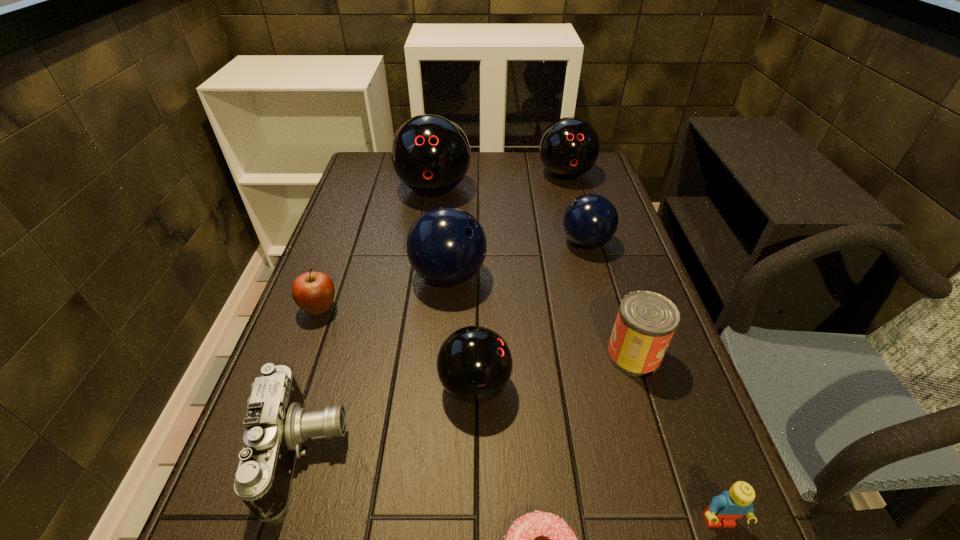
Identify the location of free space at the right edge of the desktop. This screenshot has width=960, height=540. click(x=599, y=334).

In the image, there is a desktop. Where is `vacant space at the far right corner`? vacant space at the far right corner is located at coordinates (565, 186).

I want to click on free point between the blue Lego and the camera, so click(x=512, y=487).

Where is `unoccupied position between the tallest bowling ball and the apple`? The image size is (960, 540). unoccupied position between the tallest bowling ball and the apple is located at coordinates (377, 249).

At what (x,y) coordinates should I click in order to perform the action: click on unoccupied area between the tallest bowling ball and the right blue bowling ball. Please return your answer as a coordinate pair (x, y). The image size is (960, 540). Looking at the image, I should click on click(x=510, y=216).

Where is `free space between the Lego and the nearest black bowling ball`? free space between the Lego and the nearest black bowling ball is located at coordinates (597, 453).

What are the coordinates of `free spot between the nearest bowling ball and the tallest object` in the screenshot? It's located at (454, 287).

Choose which object is the eighth nearest neighbor to the left blue bowling ball. Please provide its 2D coordinates. Your answer should be formatted as a tuple, i.e. [(x, y)], where the tuple contains the x and y coordinates of a point satisfying the conditions above.

[(539, 539)]

Where is `the second closest object to the smallest black bowling ball`? The width and height of the screenshot is (960, 540). the second closest object to the smallest black bowling ball is located at coordinates (446, 246).

This screenshot has width=960, height=540. What are the coordinates of `bowling ball that is the third closest one to the biggest black bowling ball` in the screenshot? It's located at (590, 221).